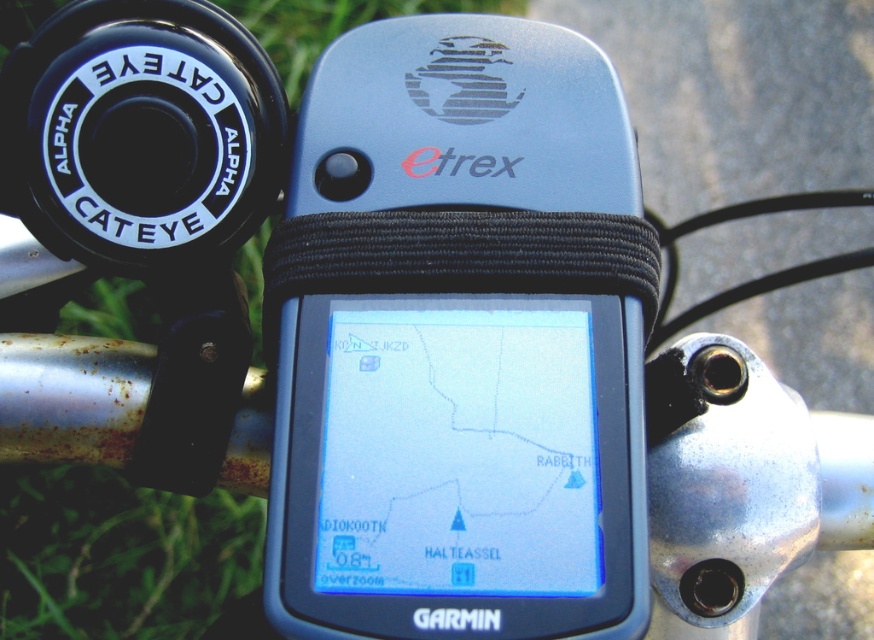
Question: Which point is farther from the camera taking this photo?

Choices:
 (A) (4, 476)
 (B) (566, 522)

Answer: (A)

Question: Does blue plastic gps at center appear under green grass at lower left?

Choices:
 (A) no
 (B) yes

Answer: (B)

Question: Can you confirm if blue plastic gps at center is bigger than green grass at lower left?

Choices:
 (A) no
 (B) yes

Answer: (A)

Question: Among these objects, which one is farthest from the camera?

Choices:
 (A) blue plastic gps at center
 (B) green grass at lower left

Answer: (B)

Question: Which point is closer to the camera taking this photo?

Choices:
 (A) (51, 564)
 (B) (390, 630)

Answer: (B)

Question: Does blue plastic gps at center have a smaller size compared to green grass at lower left?

Choices:
 (A) yes
 (B) no

Answer: (A)